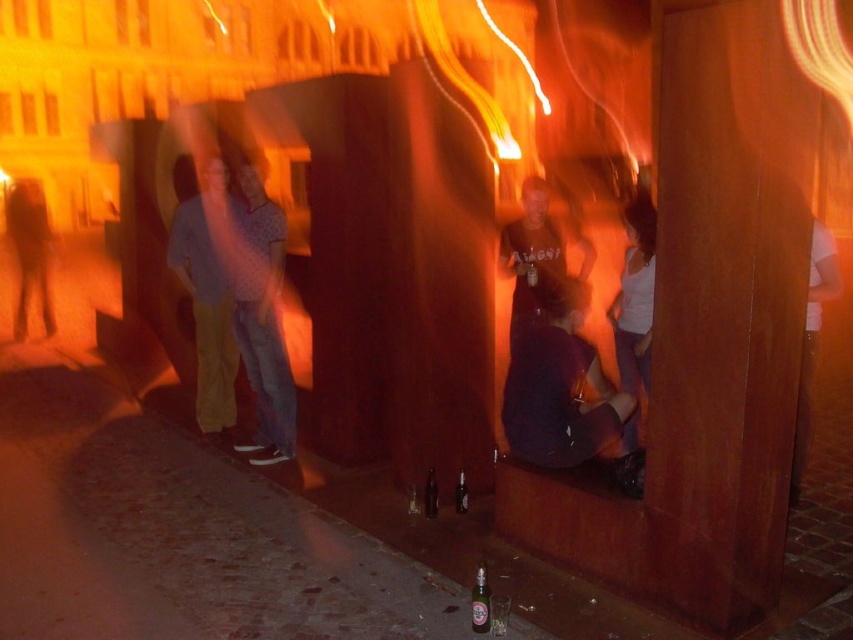
Question: Does dark purple fabric at center appear over translucent glass bottle at center?

Choices:
 (A) no
 (B) yes

Answer: (B)

Question: Can you confirm if dark purple fabric at center is positioned to the left of translucent amber bottle at lower center?

Choices:
 (A) no
 (B) yes

Answer: (A)

Question: Among these objects, which one is nearest to the camera?

Choices:
 (A) translucent glass bottle at center
 (B) translucent amber bottle at lower center

Answer: (B)

Question: Can you confirm if white cotton tank top at center is positioned to the right of translucent glass bottle at center?

Choices:
 (A) no
 (B) yes

Answer: (B)

Question: Based on their relative distances, which object is farther from the translucent amber bottle at lower center?

Choices:
 (A) white cotton tank top at center
 (B) matte yellow pants at left
 (C) translucent glass bottle at center
 (D) dark purple fabric at center

Answer: (B)

Question: Based on their relative distances, which object is nearer to the translucent glass bottle at center?

Choices:
 (A) translucent glass bottle at lower center
 (B) dark purple fabric at center
 (C) white cotton tank top at center
 (D) matte yellow pants at left

Answer: (A)